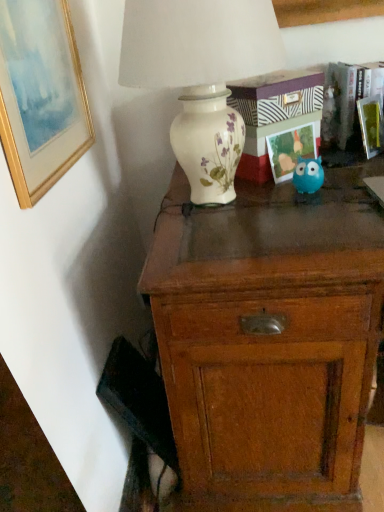
Image resolution: width=384 pixels, height=512 pixels. In order to click on unoccupied region to the right of white ceramic vase at upper center in this screenshot , I will do `click(338, 191)`.